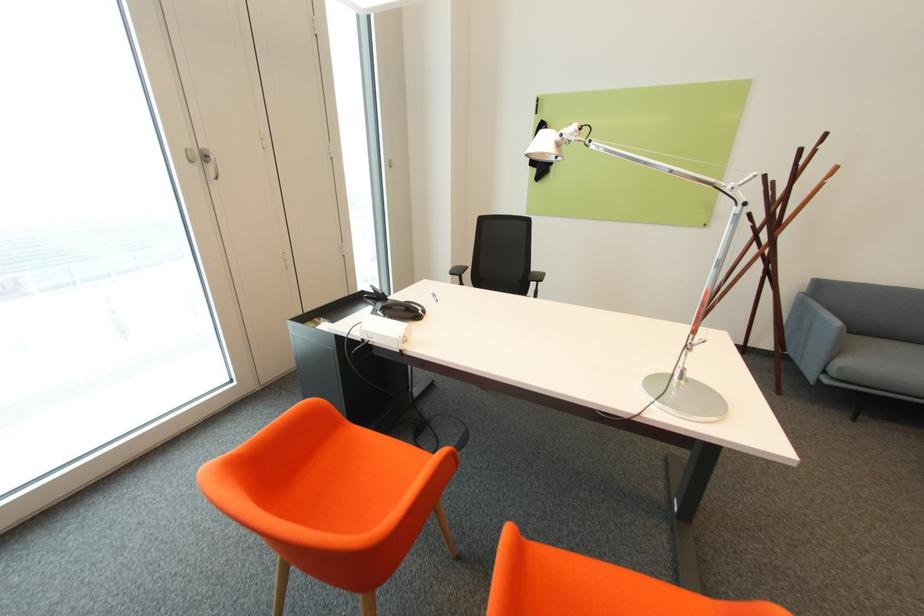
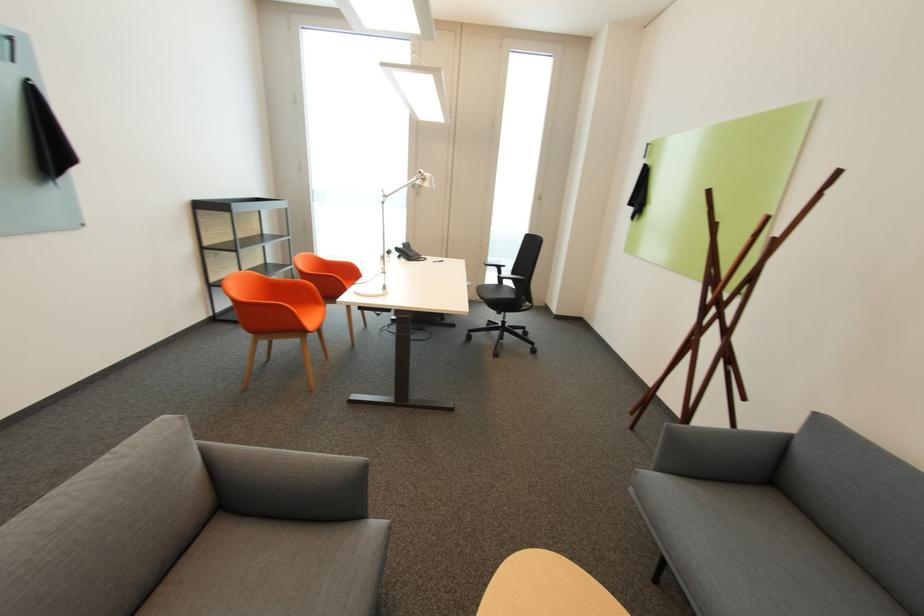
In the second image, find the point that corresponds to the point at 465,276 in the first image.

(503, 269)